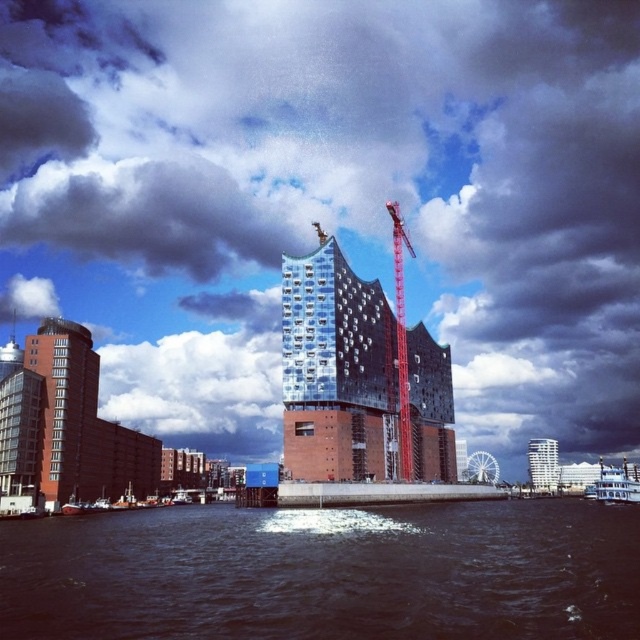
Does cloudy sky at upper center have a greater width compared to reflective glass building at center?

Yes, cloudy sky at upper center is wider than reflective glass building at center.

Which of these two, cloudy sky at upper center or reflective glass building at center, stands shorter?

Standing shorter between the two is reflective glass building at center.

This screenshot has height=640, width=640. What do you see at coordinates (330, 200) in the screenshot?
I see `cloudy sky at upper center` at bounding box center [330, 200].

Identify the location of cloudy sky at upper center. Image resolution: width=640 pixels, height=640 pixels. (330, 200).

Measure the distance between point (481, 612) and camera.

Point (481, 612) and camera are 31.08 meters apart.

Identify the location of dark water at lower center. This screenshot has height=640, width=640. (326, 573).

Does point (449, 604) lie behind point (380, 420)?

No, (449, 604) is closer to viewer.

This screenshot has width=640, height=640. Identify the location of dark water at lower center. (326, 573).